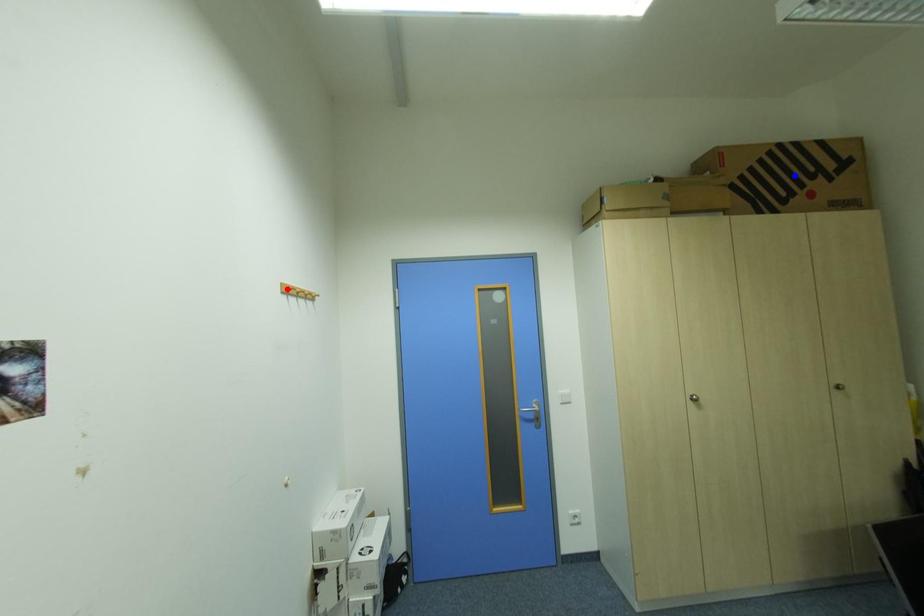
Question: Two points are marked on the image. Which point is closer to the camera?

Choices:
 (A) Blue point is closer.
 (B) Red point is closer.

Answer: (B)